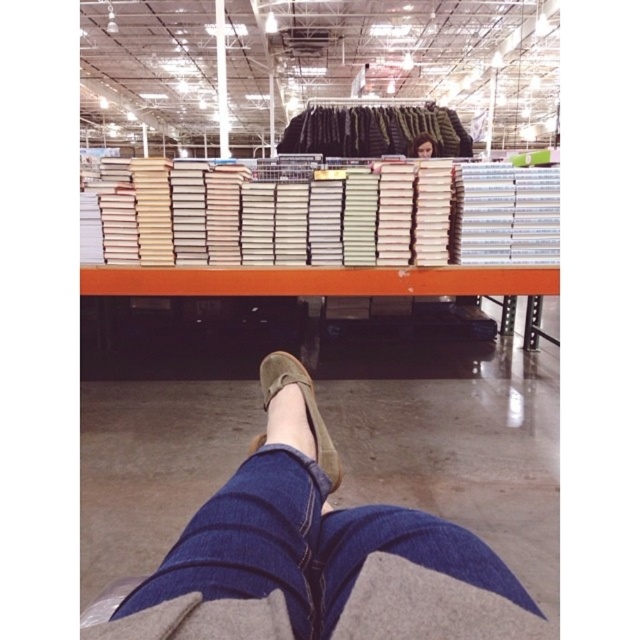
From the picture: Can you confirm if suede shoe at lower center is positioned to the left of smooth brown hair at upper center?

Indeed, suede shoe at lower center is positioned on the left side of smooth brown hair at upper center.

Is point (278, 371) farther from viewer compared to point (424, 138)?

No.

Does point (328, 456) come farther from viewer compared to point (426, 156)?

No, (328, 456) is closer to viewer.

The image size is (640, 640). In order to click on suede shoe at lower center in this screenshot , I will do `click(305, 406)`.

Does denim pants at lower center lie in front of smooth brown hair at upper center?

Yes, denim pants at lower center is closer to the viewer.

This screenshot has width=640, height=640. Identify the location of denim pants at lower center. (316, 554).

This screenshot has width=640, height=640. In order to click on denim pants at lower center in this screenshot , I will do `click(316, 554)`.

Based on the photo, does white paper books at center have a lesser width compared to suede shoe at lower center?

No.

Between point (557, 227) and point (294, 369), which one is positioned in front?

Positioned in front is point (294, 369).

What do you see at coordinates (324, 214) in the screenshot?
I see `white paper books at center` at bounding box center [324, 214].

Where is `white paper books at center`? white paper books at center is located at coordinates (324, 214).